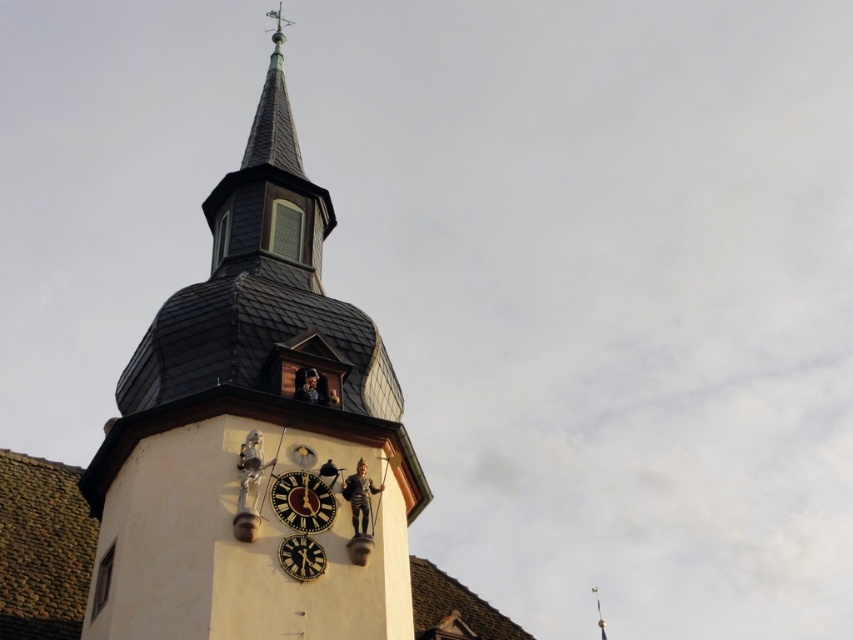
From the picture: Is smooth gray stone clock tower at center bigger than wooden clock at center?

Indeed, smooth gray stone clock tower at center has a larger size compared to wooden clock at center.

Does smooth gray stone clock tower at center appear over wooden clock at center?

Yes, smooth gray stone clock tower at center is above wooden clock at center.

Locate an element on the screen. The height and width of the screenshot is (640, 853). smooth gray stone clock tower at center is located at coordinates (248, 428).

Between smooth gray stone clock tower at center and black metal clock at center, which one appears on the right side from the viewer's perspective?

From the viewer's perspective, black metal clock at center appears more on the right side.

Can you confirm if smooth gray stone clock tower at center is thinner than black metal clock at center?

Incorrect, smooth gray stone clock tower at center's width is not less than black metal clock at center's.

Between point (254, 272) and point (302, 560), which one is positioned behind?

Positioned behind is point (254, 272).

Where is `smooth gray stone clock tower at center`? The height and width of the screenshot is (640, 853). smooth gray stone clock tower at center is located at coordinates (248, 428).

Does wooden clock at center have a smaller size compared to black metal clock at center?

Actually, wooden clock at center might be larger than black metal clock at center.

Is wooden clock at center below black metal clock at center?

Actually, wooden clock at center is above black metal clock at center.

This screenshot has width=853, height=640. What do you see at coordinates (302, 500) in the screenshot? I see `wooden clock at center` at bounding box center [302, 500].

Locate an element on the screen. wooden clock at center is located at coordinates [x=302, y=500].